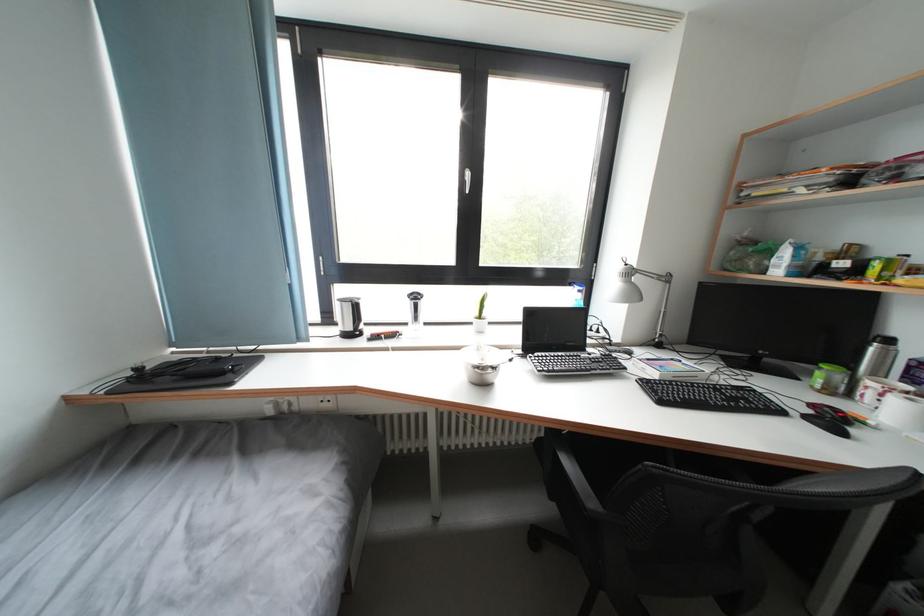
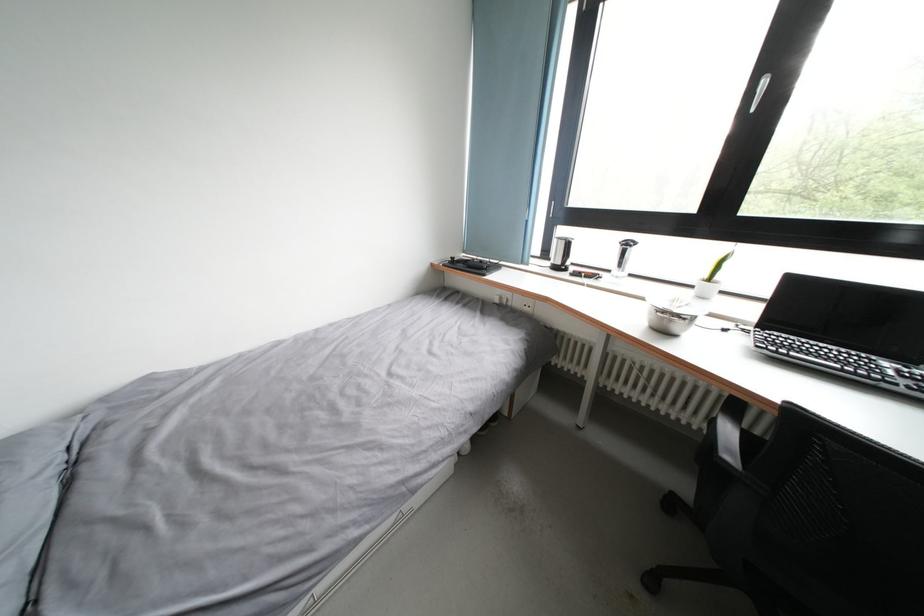
Where in the second image is the point corresponding to [314,408] from the first image?

(524, 308)